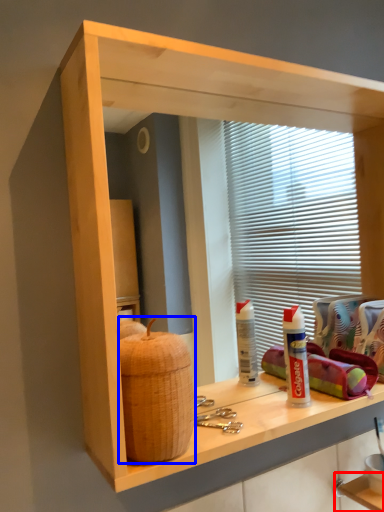
Question: Which point is further to the camera, shelf (highlighted by a red box) or basket (highlighted by a blue box)?

Choices:
 (A) shelf
 (B) basket

Answer: (A)